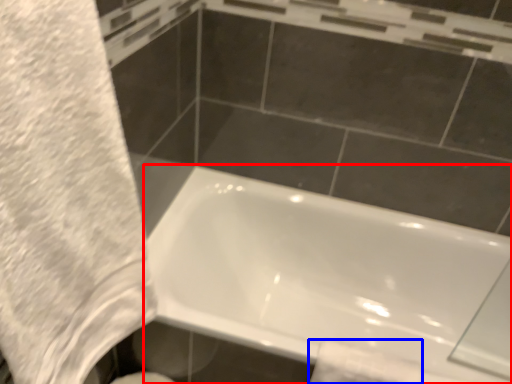
Question: Among these objects, which one is farthest to the camera, bathtub (highlighted by a red box) or toilet paper (highlighted by a blue box)?

Choices:
 (A) bathtub
 (B) toilet paper

Answer: (B)